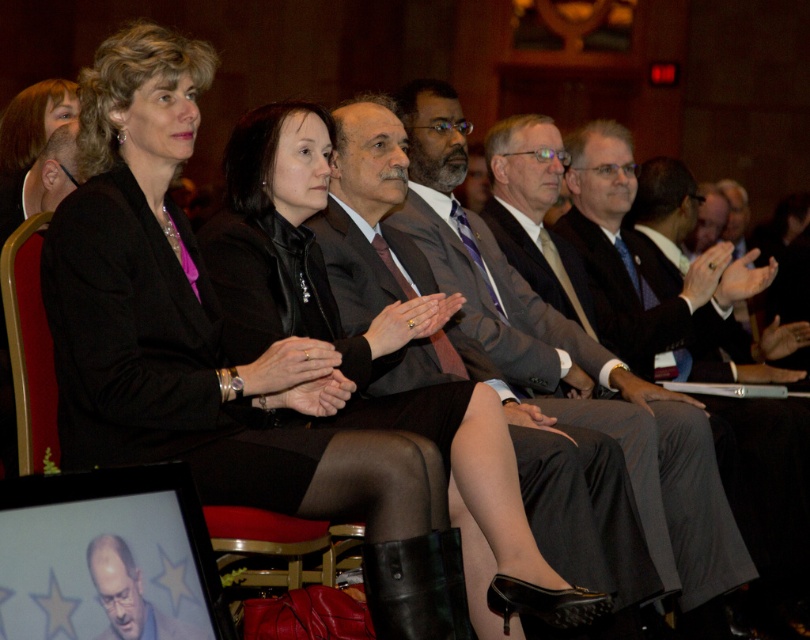
Question: Does gray suit at center have a smaller size compared to smooth bald head at center?

Choices:
 (A) yes
 (B) no

Answer: (B)

Question: Which object is closer to the camera taking this photo?

Choices:
 (A) matte gray suit at center
 (B) matte black jacket at center
 (C) smooth bald head at center

Answer: (C)

Question: Among these points, which one is farthest from the camera?

Choices:
 (A) (105, 593)
 (B) (693, 557)

Answer: (B)

Question: Which point appears farthest from the camera in this image?

Choices:
 (A) (131, 611)
 (B) (126, 419)

Answer: (B)

Question: Can you confirm if matte gray suit at center is positioned to the left of gray suit at center?

Choices:
 (A) no
 (B) yes

Answer: (B)

Question: Does matte black jacket at center have a larger size compared to matte gray suit at center?

Choices:
 (A) no
 (B) yes

Answer: (A)